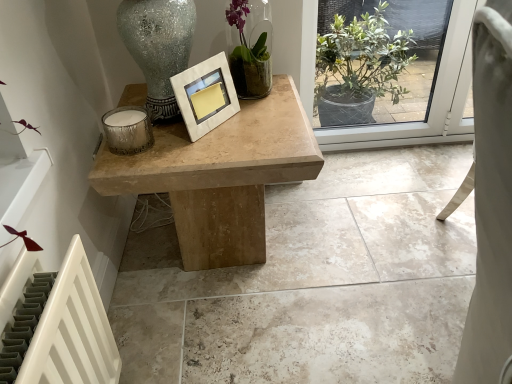
Where is `vacant location below natural wood table at center (from a real-world perspective)`? vacant location below natural wood table at center (from a real-world perspective) is located at coordinates (223, 263).